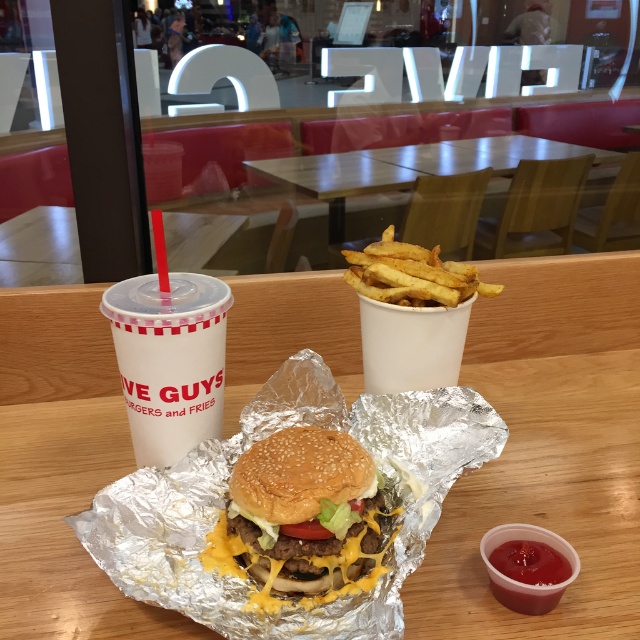
You are sitting at the wooden table at center where the meal is placed. There is a point marked at coordinates [547,449]. Is this point located on the wooden table at center?

Yes, the point [547,449] is on the wooden table at center.

You are a food delivery person who needs to place the golden brown bun at center and the golden crispy fries at center into a single compartment of a takeout container. The container has a height limit of 10 cm. Can both items fit vertically without exceeding the height limit?

The golden brown bun at center is positioned under golden crispy fries at center, but their combined height is not provided. Therefore, it is uncertain if they can fit within the 10 cm height limit.

Consider the image. You are at Five Guys and want to place your burger on the wooden table at center. However, you notice the white paper cup at center is already there. Based on their positions, which object is closer to the left edge of the table?

The wooden table at center is positioned on the left side of white paper cup at center, so the wooden table at center is closer to the left edge of the table.